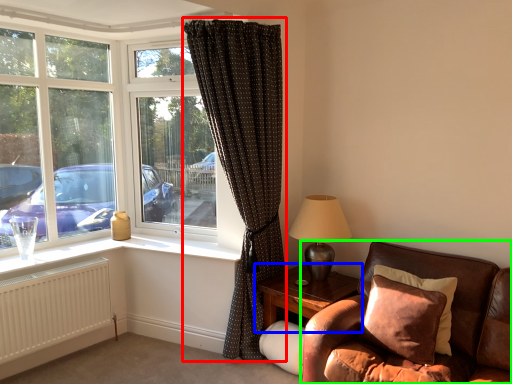
Question: Which object is the closest to the curtain (highlighted by a red box)? Choose among these: table (highlighted by a blue box) or studio couch (highlighted by a green box).

Choices:
 (A) table
 (B) studio couch

Answer: (A)